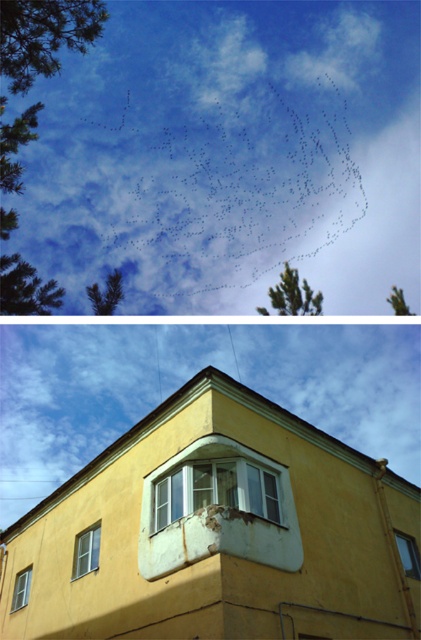
Question: Can you confirm if clear glass window at lower left is bigger than clear glass window at lower right?

Choices:
 (A) yes
 (B) no

Answer: (A)

Question: Which point is closer to the camera?

Choices:
 (A) clear glass window at lower left
 (B) clear glass window at lower right

Answer: (A)

Question: Is white plastic window at center wider than white glass window at upper center?

Choices:
 (A) no
 (B) yes

Answer: (B)

Question: Is clear glass window at lower left to the right of clear glass window at lower right from the viewer's perspective?

Choices:
 (A) no
 (B) yes

Answer: (A)

Question: Estimate the real-world distances between objects in this image. Which object is closer to the white plastic window at center?

Choices:
 (A) white glass window at upper center
 (B) clear glass window at lower left

Answer: (B)

Question: Which of the following is the closest to the observer?

Choices:
 (A) (202, 464)
 (B) (416, 547)
 (C) (21, 584)
 (D) (82, 570)

Answer: (A)